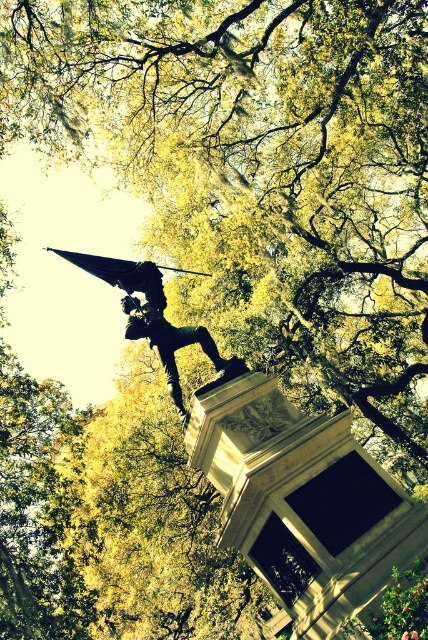
You are standing at the origin point of the coordinate system in the scene. The shiny bronze statue at center is at coordinates approximately 0.494 in the x direction and 0.357 in the y direction. If you want to walk directly towards the statue, in which general direction should you move from your current position?

Since the shiny bronze statue at center is located at coordinates approximately 0.494 in the x direction and 0.357 in the y direction, you should move in the general direction of northeast to reach it. This is because the x coordinate is slightly to the right of center and the y coordinate is slightly below center, indicating a diagonal path towards the upper right.